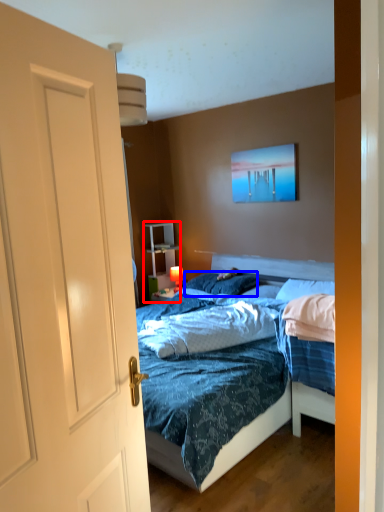
Question: Which of the following is the closest to the observer, armoire (highlighted by a red box) or pillow (highlighted by a blue box)?

Choices:
 (A) armoire
 (B) pillow

Answer: (B)